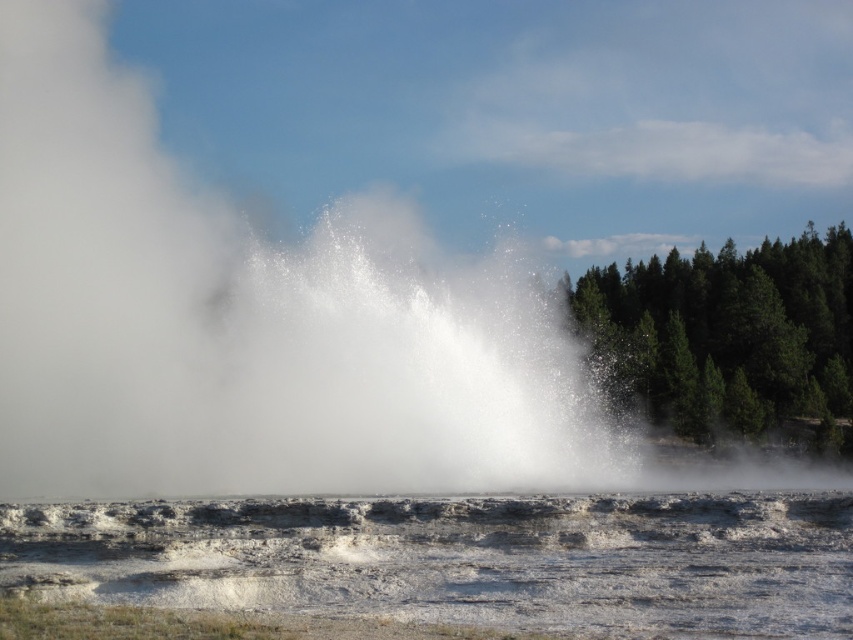
You are a photographer trying to capture the geyser eruption. You notice the white vapor at center and the white rocky water at center. Which one is positioned higher in the image?

The white vapor at center is positioned higher than the white rocky water at center because it is located above it.

You are standing at the base of the geyser and want to avoid the steam. Which direction should you move to stay clear of the white vapor at center?

Move away from the white vapor at center, which is located at point coordinates 0.505 on the x axis and 0.294 on the y axis.